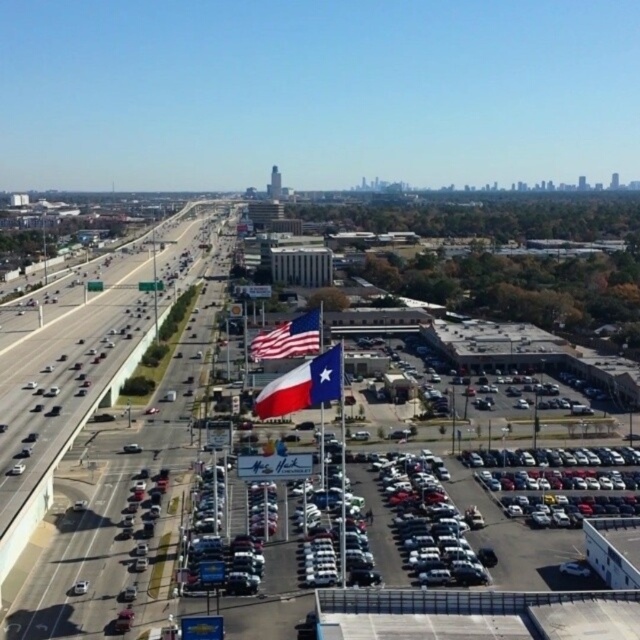
Question: Which of the following is the closest to the observer?

Choices:
 (A) texas flag at center
 (B) silver metallic car at lower right
 (C) asphalt road at center

Answer: (C)

Question: Which point appears closest to the camera in this image?

Choices:
 (A) (52, 554)
 (B) (413, 525)
 (C) (280, 346)

Answer: (A)

Question: Does asphalt road at center appear over matte american flag at center?

Choices:
 (A) yes
 (B) no

Answer: (A)

Question: Which object is closer to the camera taking this photo?

Choices:
 (A) texas flag at center
 (B) asphalt road at center

Answer: (B)

Question: Is asphalt road at center above metallic gray highway at left?

Choices:
 (A) no
 (B) yes

Answer: (B)

Question: Does metallic gray highway at left come behind silver metallic car at lower right?

Choices:
 (A) yes
 (B) no

Answer: (B)